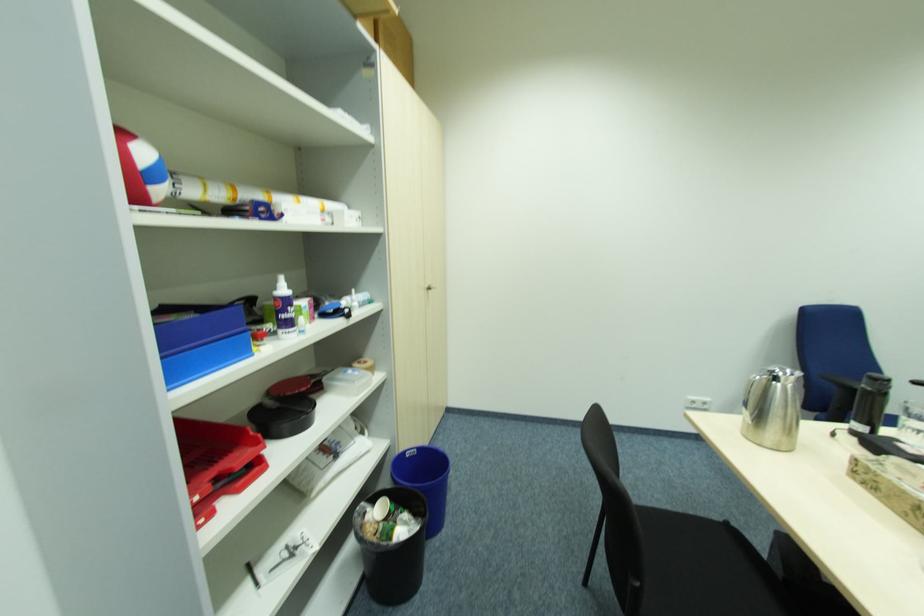
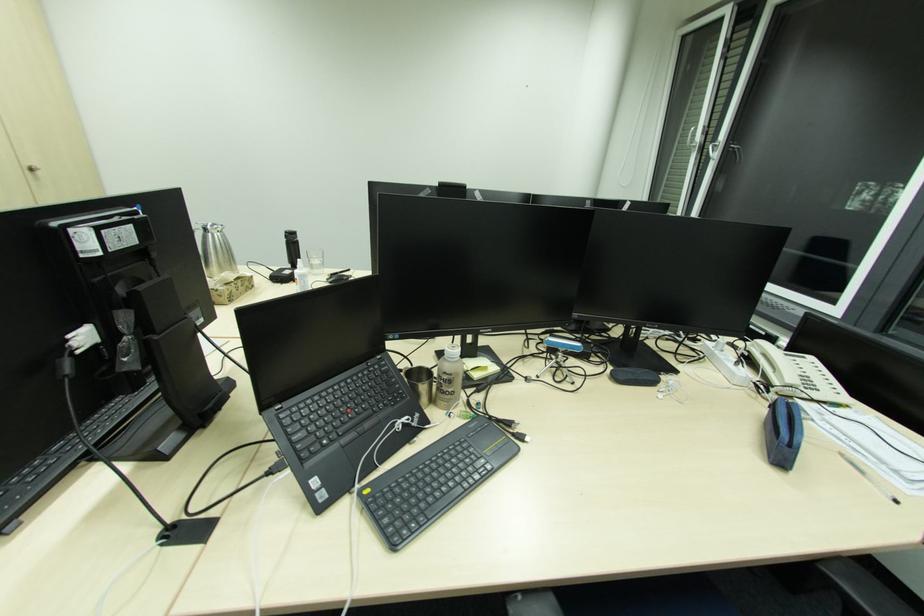
The images are taken continuously from a first-person perspective. In which direction are you moving?

The cameraman walked toward right, backward.